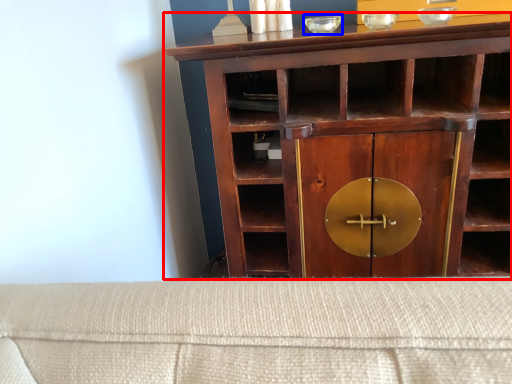
Question: Which of the following is the farthest to the observer, cupboard (highlighted by a red box) or glass bowl (highlighted by a blue box)?

Choices:
 (A) cupboard
 (B) glass bowl

Answer: (B)